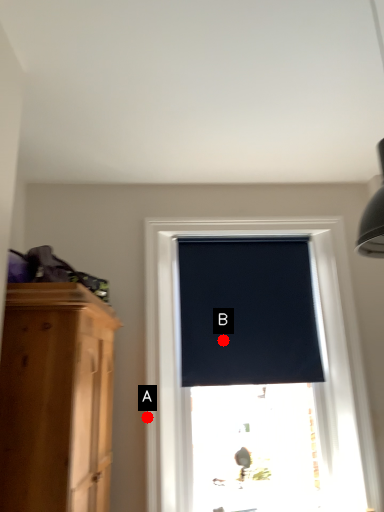
Question: Two points are circled on the image, labeled by A and B beside each circle. Which of the following is the farthest from the observer?

Choices:
 (A) A is further
 (B) B is further

Answer: (B)